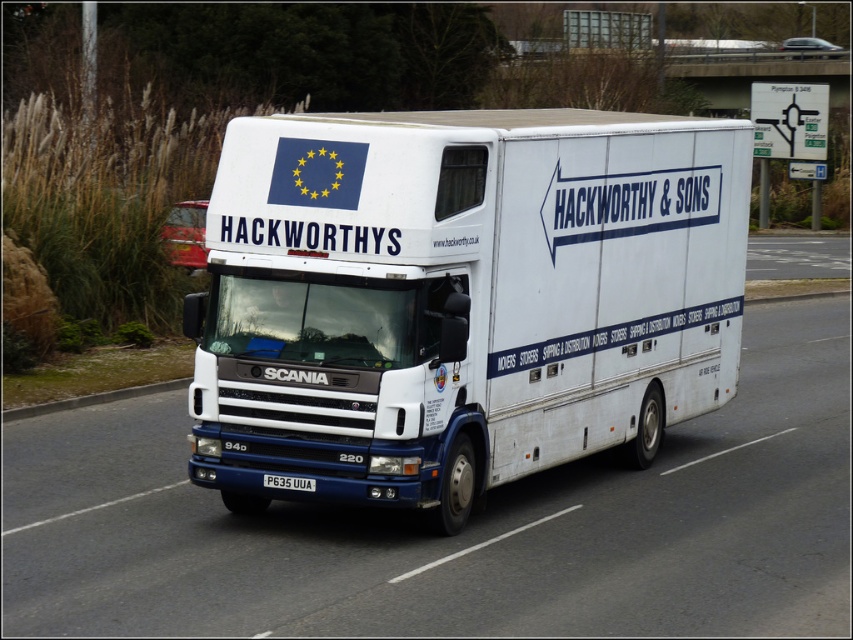
You are a traffic officer who needs to ensure vehicles maintain a safe distance on the highway. The minimum safe distance between two vehicles is 10 feet. You observe a white matte trailer truck at center and a white glossy truck at center. Are they maintaining a safe distance?

The white matte trailer truck at center and white glossy truck at center are 13.54 feet apart from each other, which exceeds the minimum safe distance of 10 feet. Therefore, they are maintaining a safe distance.